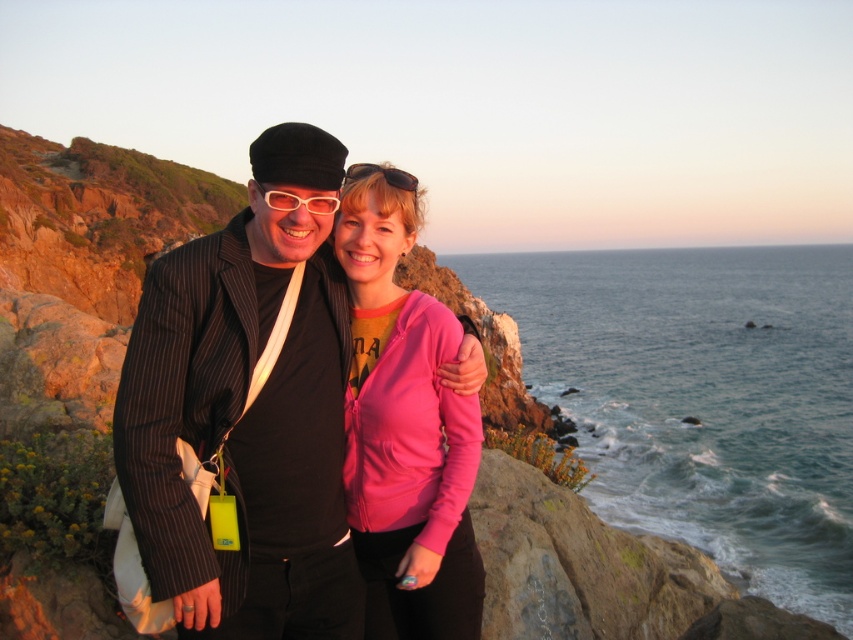
You are a photographer trying to capture a wide shot of the blue water at center and the pink matte sunglasses at center in the coastal scene. Given their distance apart, will you need to use a wide angle lens to ensure both fit in the frame?

The blue water at center and pink matte sunglasses at center are 134.72 meters apart. To capture both in the same frame, a wide angle lens would be necessary due to the significant distance between them.

You are a photographer positioned behind the two people in the scene. You want to take a photo that includes both the matte black suit at center and the pink fleece jacket at center. Which one will appear larger in the photo?

The matte black suit at center will appear larger in the photo because it is closer to the viewer than the pink fleece jacket at center.